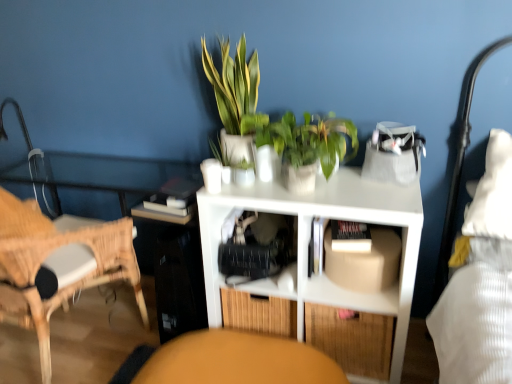
This screenshot has width=512, height=384. What are the coordinates of `vacant point above beige cardboard box at center (from a real-world perspective)` in the screenshot? It's located at (355, 237).